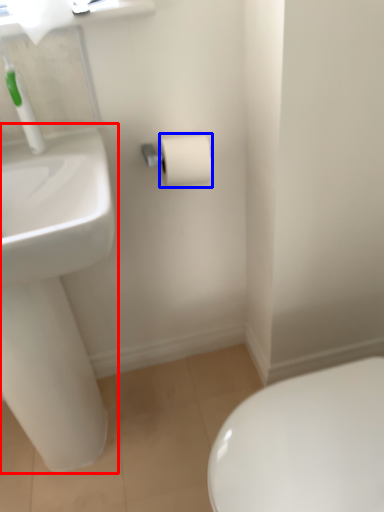
Question: Which point is further to the camera, sink (highlighted by a red box) or toilet paper (highlighted by a blue box)?

Choices:
 (A) sink
 (B) toilet paper

Answer: (B)